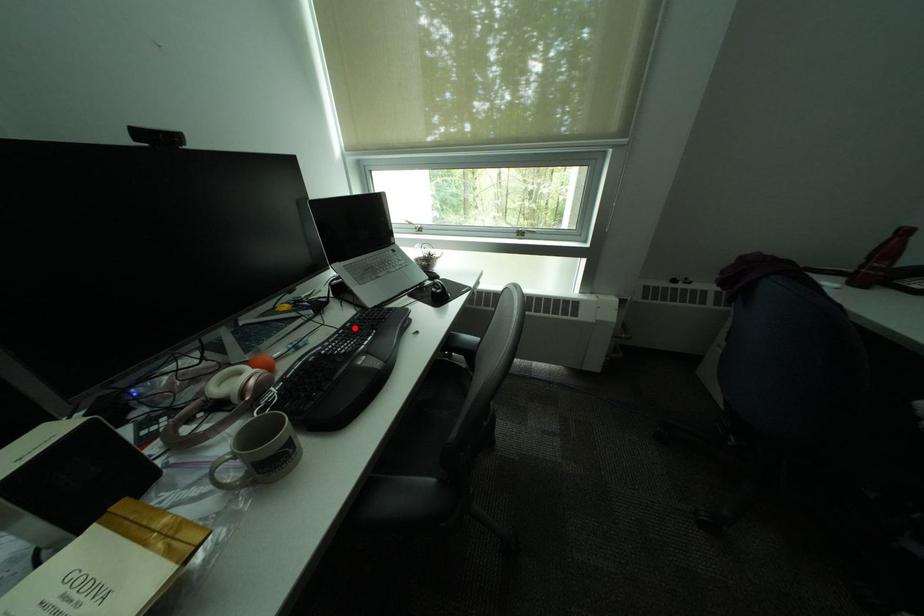
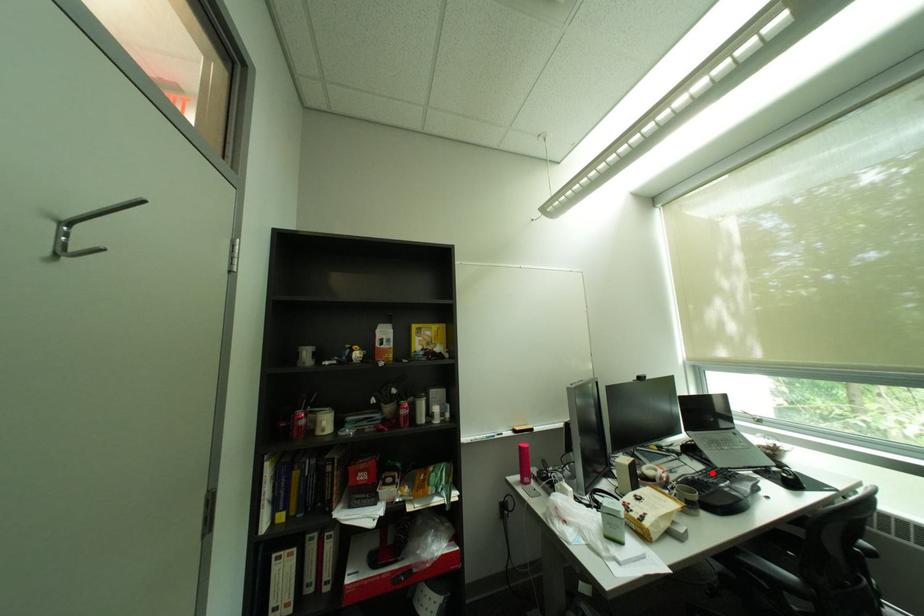
I am providing you with two images of the same scene from different viewpoints. A red point is marked on the first image and another point is marked on the second image. Does the point marked in image1 correspond to the same location as the one in image2?

Yes